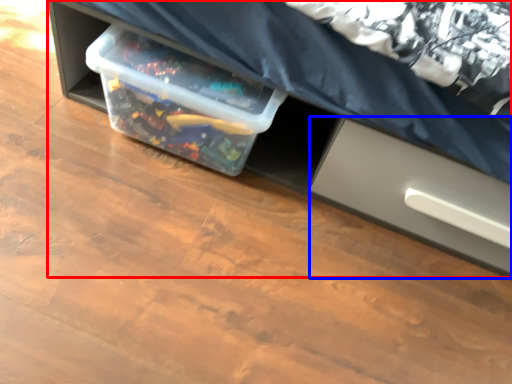
Question: Among these objects, which one is nearest to the camera, furniture (highlighted by a red box) or drawer (highlighted by a blue box)?

Choices:
 (A) furniture
 (B) drawer

Answer: (A)